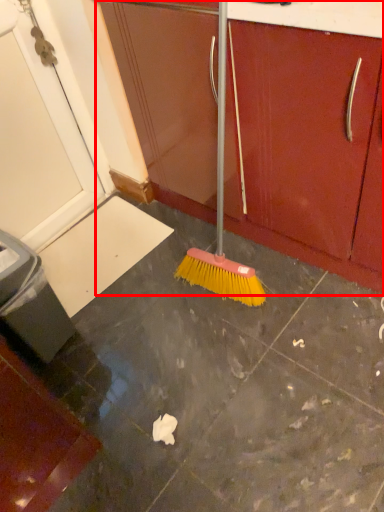
Question: From the image, what is the correct spatial relationship of cabinetry (annotated by the red box) in relation to drawer?

Choices:
 (A) left
 (B) right

Answer: (A)